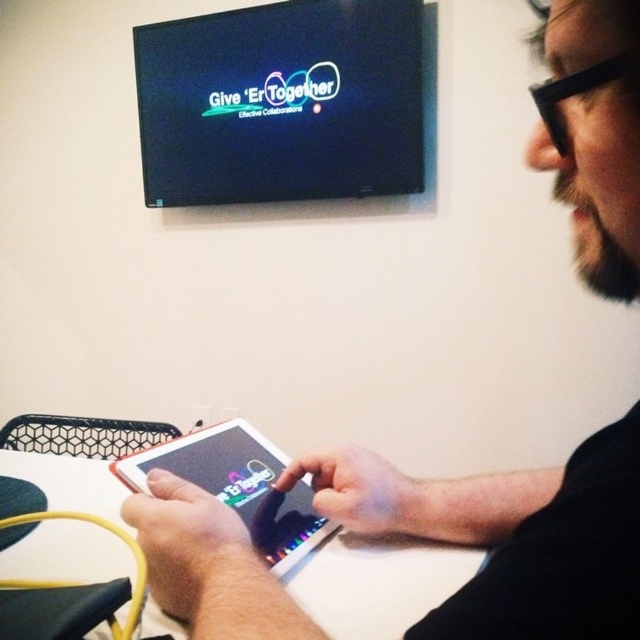
Measure the distance between white glossy table at center and camera.

white glossy table at center is 20.43 inches from camera.

Is white glossy table at center positioned behind matte black tablet at center?

No, it is not.

Is point (308, 580) farther from viewer compared to point (237, 445)?

No.

You are a GUI agent. You are given a task and a screenshot of the screen. Output one action in this format:
    pyautogui.click(x=<x>, y=<y>)
    Task: Click on the white glossy table at center
    This screenshot has width=640, height=640.
    Given the screenshot: What is the action you would take?
    pyautogui.click(x=378, y=582)